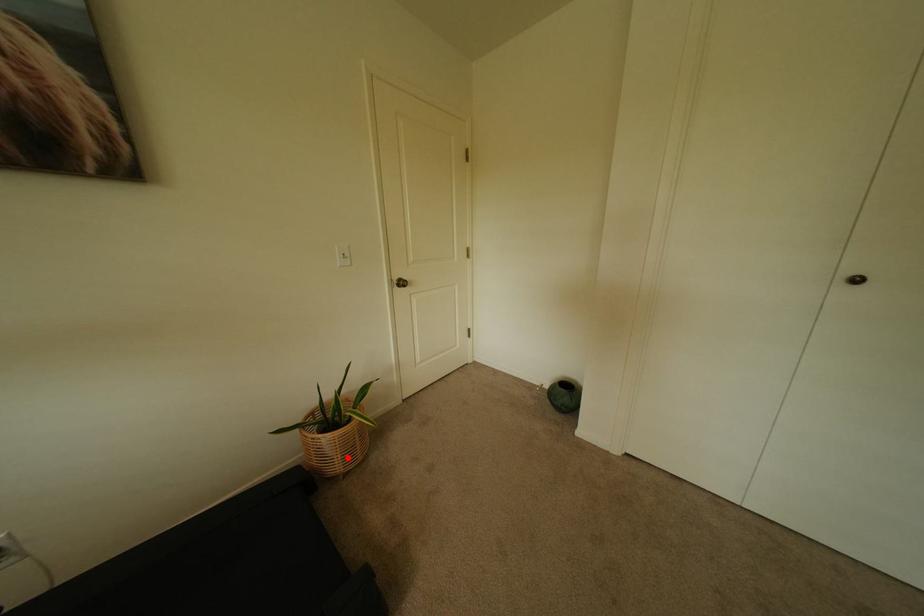
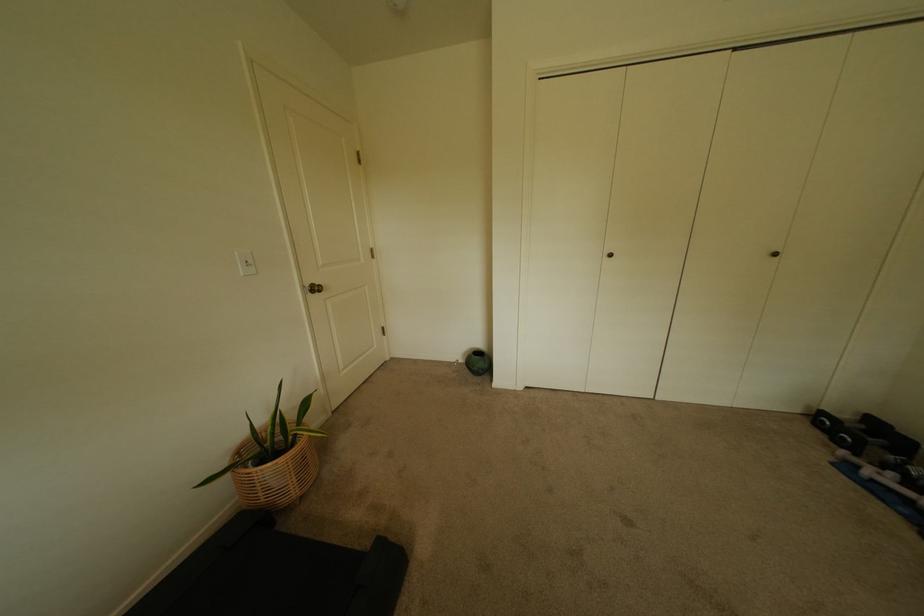
The point at the highlighted location is marked in the first image. Where is the corresponding point in the second image?

(302, 480)